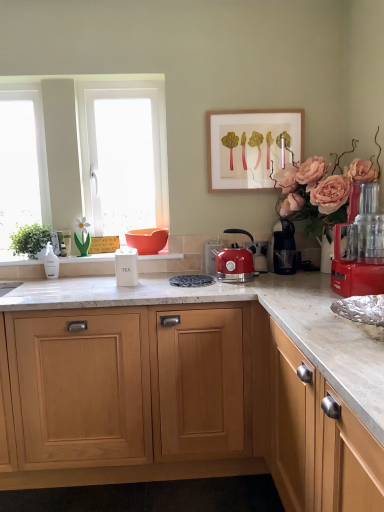
Find the location of a particular element. The width and height of the screenshot is (384, 512). vacant area that lies to the right of white matte tea container at center, acting as the 4th kitchen appliance starting from the right is located at coordinates (152, 286).